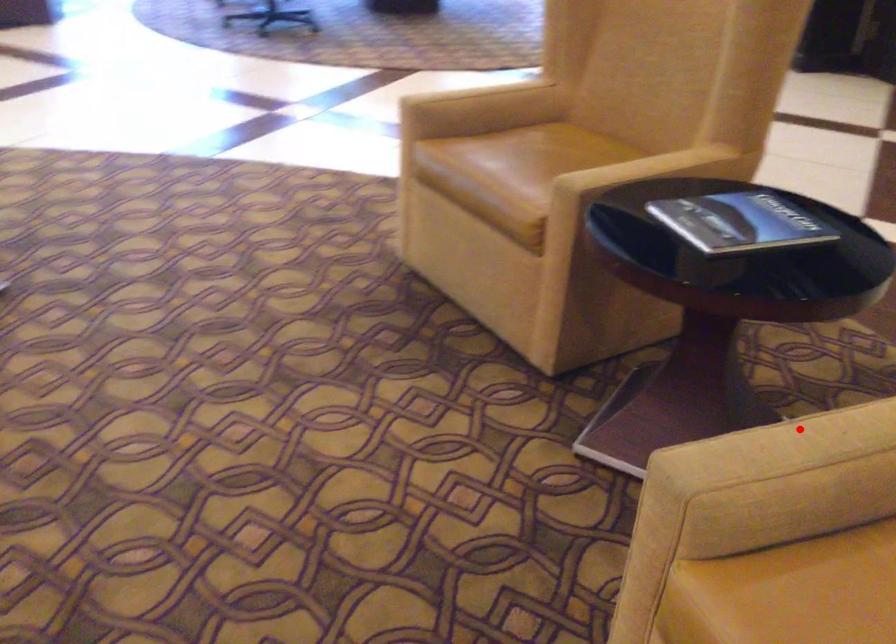
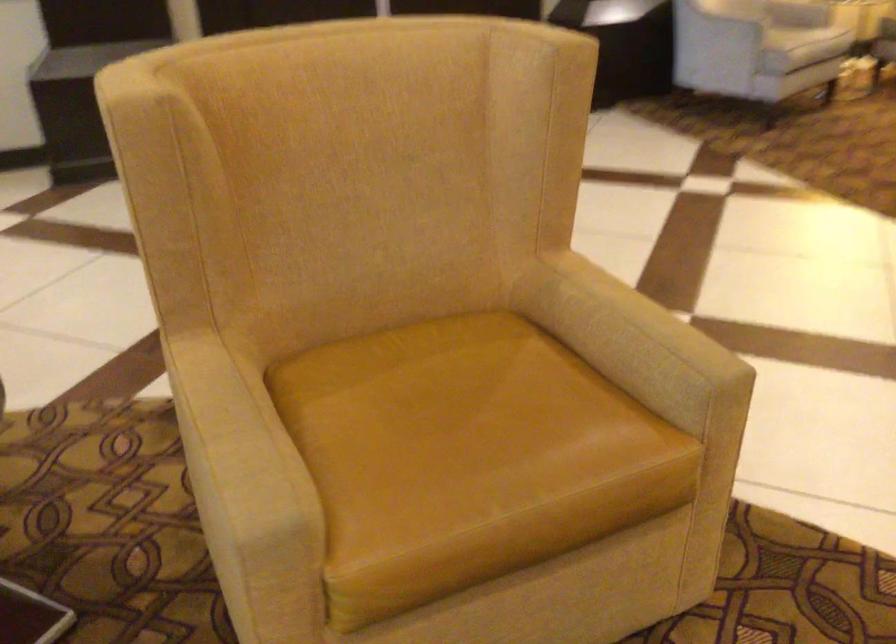
Where in the second image is the point corresponding to the highlighted location from the first image?

(235, 435)